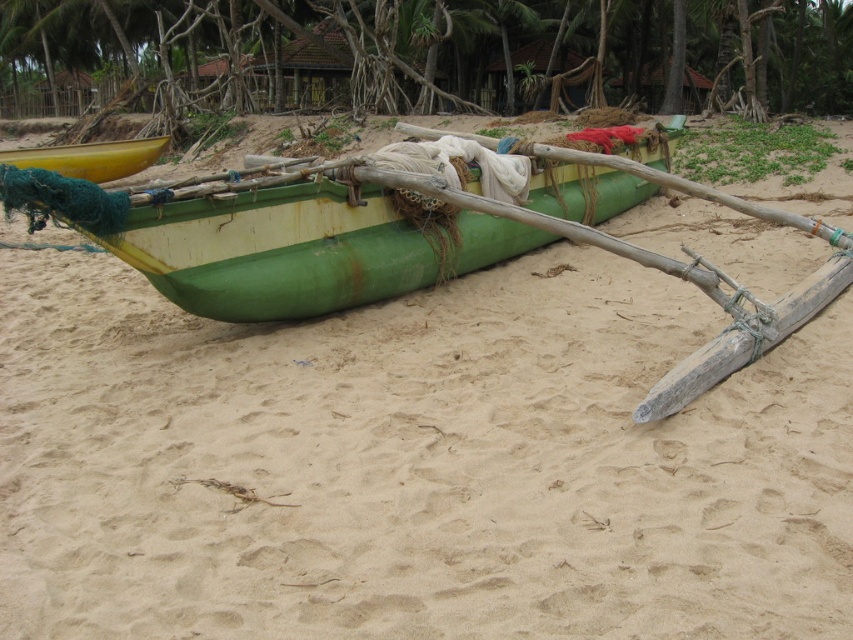
Question: Which point is closer to the camera?

Choices:
 (A) green matte boat at center
 (B) yellow matte canoe at left

Answer: (A)

Question: Is green matte boat at center bigger than yellow matte canoe at left?

Choices:
 (A) yes
 (B) no

Answer: (A)

Question: Which point is farther to the camera?

Choices:
 (A) (422, 273)
 (B) (103, 180)

Answer: (B)

Question: Can you confirm if green matte boat at center is positioned to the left of yellow matte canoe at left?

Choices:
 (A) yes
 (B) no

Answer: (B)

Question: Considering the relative positions of green matte boat at center and yellow matte canoe at left in the image provided, where is green matte boat at center located with respect to yellow matte canoe at left?

Choices:
 (A) right
 (B) left

Answer: (A)